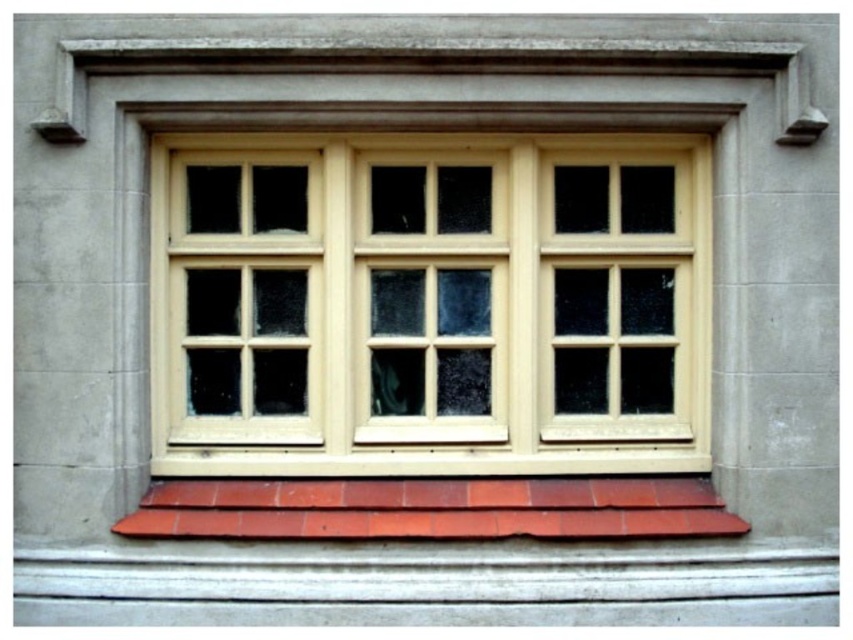
Between point (666, 166) and point (325, 513), which one is positioned behind?

Positioned behind is point (666, 166).

Does matte wood window frame at center have a smaller size compared to smooth terracotta tiles at bottom?

Actually, matte wood window frame at center might be larger than smooth terracotta tiles at bottom.

Does point (334, 397) lie behind point (230, 486)?

That is True.

Locate an element on the screen. This screenshot has width=853, height=640. matte wood window frame at center is located at coordinates (430, 305).